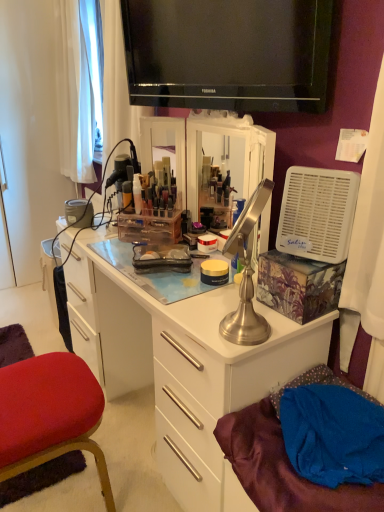
Question: Considering the positions of satin silver desk at center and blue fabric at lower right in the image, is satin silver desk at center taller or shorter than blue fabric at lower right?

Choices:
 (A) short
 (B) tall

Answer: (B)

Question: From the image's perspective, is satin silver desk at center located above or below blue fabric at lower right?

Choices:
 (A) below
 (B) above

Answer: (B)

Question: Estimate the real-world distances between objects in this image. Which object is farther from the blue fabric at lower right?

Choices:
 (A) satin silver desk at center
 (B) satin silver lamp at center
 (C) velvet red chair at lower left
 (D) black glossy television at upper center
 (E) white plastic fan at right

Answer: (D)

Question: Which object is positioned farthest from the white plastic fan at right?

Choices:
 (A) blue fabric at lower right
 (B) satin silver lamp at center
 (C) black glossy television at upper center
 (D) velvet red chair at lower left
 (E) satin silver desk at center

Answer: (D)